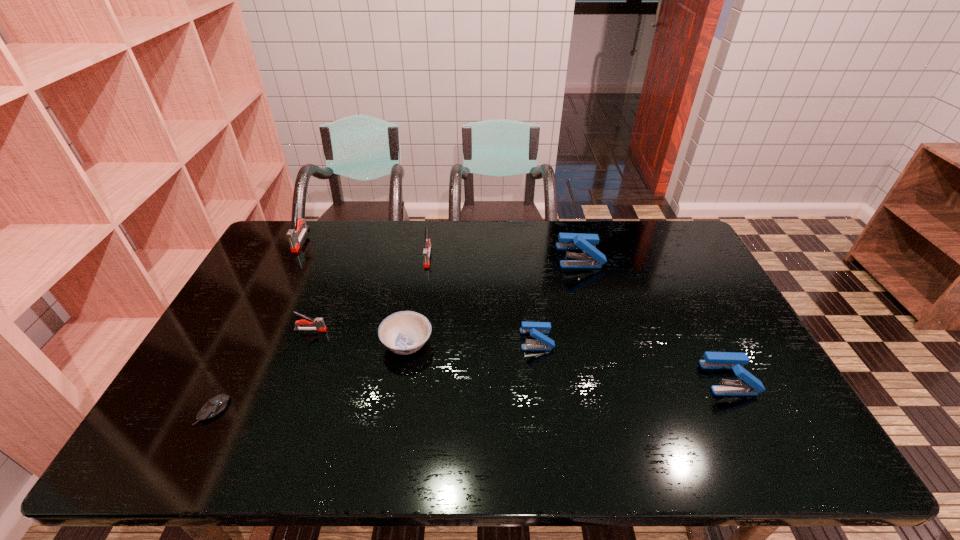
Image resolution: width=960 pixels, height=540 pixels. I want to click on the biggest gray stapler, so tap(294, 240).

I want to click on the leftmost gray stapler, so click(294, 240).

Where is `the biggest blue stapler`? the biggest blue stapler is located at coordinates (593, 258).

Identify the location of the seventh object from left to right. (593, 258).

Locate an element on the screen. Image resolution: width=960 pixels, height=540 pixels. the rightmost gray stapler is located at coordinates pos(427,243).

The height and width of the screenshot is (540, 960). Find the location of `the second smallest gray stapler`. the second smallest gray stapler is located at coordinates (427, 243).

Locate an element on the screen. The height and width of the screenshot is (540, 960). the rightmost blue stapler is located at coordinates pyautogui.click(x=749, y=385).

Locate an element on the screen. Image resolution: width=960 pixels, height=540 pixels. the nearest stapler is located at coordinates (749, 385).

Locate an element on the screen. the nearest gray stapler is located at coordinates (319, 324).

The width and height of the screenshot is (960, 540). What are the coordinates of `the second gray stapler from right to left` in the screenshot? It's located at (319, 324).